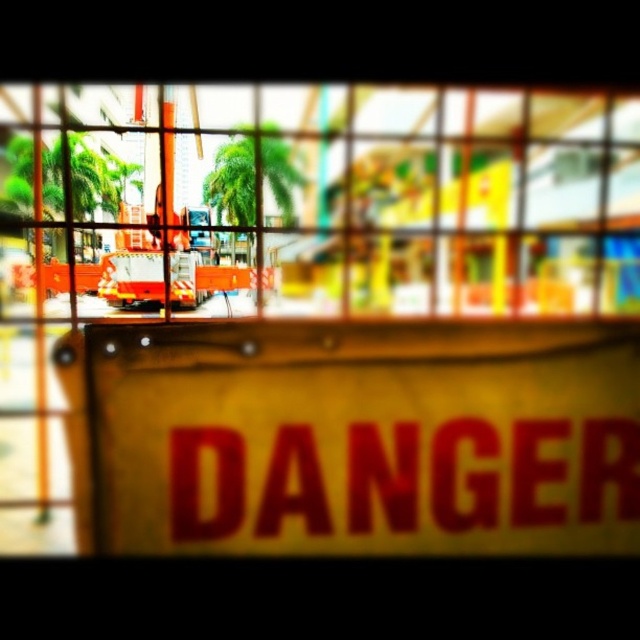
Is yellow matte sign at center taller than yellow/yellowish paper at center?

Indeed, yellow matte sign at center has a greater height compared to yellow/yellowish paper at center.

Which is above, yellow matte sign at center or yellow/yellowish paper at center?

yellow matte sign at center is above.

Describe the element at coordinates (355, 336) in the screenshot. This screenshot has height=640, width=640. I see `yellow matte sign at center` at that location.

I want to click on yellow matte sign at center, so click(355, 336).